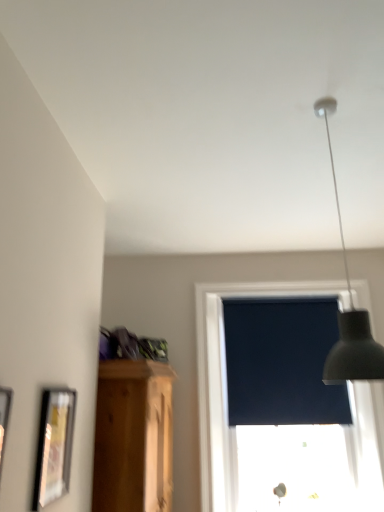
The image size is (384, 512). Describe the element at coordinates (225, 383) in the screenshot. I see `matte black roller blind at upper right` at that location.

Find the location of a particular element. This screenshot has width=384, height=512. wooden picture frame at left, the 2th picture frame in the back-to-front sequence is located at coordinates (4, 419).

Find the location of `dark matte window screen at center`. dark matte window screen at center is located at coordinates (x=282, y=362).

What do you see at coordinates (282, 362) in the screenshot?
I see `dark matte window screen at center` at bounding box center [282, 362].

Identify the location of matte black picture frame at lower left, the 1th picture frame viewed from the back. This screenshot has width=384, height=512. (54, 446).

This screenshot has width=384, height=512. I want to click on matte black roller blind at upper right, so click(225, 383).

Can you confirm if matte black lampshade at upper right is taller than dark matte window screen at center?

Indeed, matte black lampshade at upper right has a greater height compared to dark matte window screen at center.

Which of these two, matte black lampshade at upper right or dark matte window screen at center, is bigger?

With larger size is matte black lampshade at upper right.

Would you say matte black lampshade at upper right is inside or outside dark matte window screen at center?

matte black lampshade at upper right is spatially situated outside dark matte window screen at center.

Is matte black lampshade at upper right next to dark matte window screen at center?

No, matte black lampshade at upper right is not touching dark matte window screen at center.

Measure the distance between matte black picture frame at lower left, the 1th picture frame viewed from the back, and dark matte window screen at center.

matte black picture frame at lower left, the 1th picture frame viewed from the back, and dark matte window screen at center are 7.08 feet apart from each other.

From a real-world perspective, is matte black picture frame at lower left, the 1th picture frame viewed from the back, positioned under dark matte window screen at center based on gravity?

Yes, from a real-world perspective, matte black picture frame at lower left, the 1th picture frame viewed from the back, is beneath dark matte window screen at center.

Is matte black picture frame at lower left, the 2th picture frame from the front, next to dark matte window screen at center?

There is a gap between matte black picture frame at lower left, the 2th picture frame from the front, and dark matte window screen at center.

Considering the relative sizes of matte black picture frame at lower left, the 1th picture frame viewed from the back, and dark matte window screen at center in the image provided, is matte black picture frame at lower left, the 1th picture frame viewed from the back, thinner than dark matte window screen at center?

No.

Which is correct: matte black picture frame at lower left, the 2th picture frame from the front, is inside wooden picture frame at left, the 2th picture frame in the back-to-front sequence, or outside of it?

matte black picture frame at lower left, the 2th picture frame from the front, is not enclosed by wooden picture frame at left, the 2th picture frame in the back-to-front sequence.

From the image's perspective, would you say matte black picture frame at lower left, the 2th picture frame from the front, is positioned over wooden picture frame at left, the 2th picture frame in the back-to-front sequence?

No, from the image's perspective, matte black picture frame at lower left, the 2th picture frame from the front, is not on top of wooden picture frame at left, the 2th picture frame in the back-to-front sequence.

Could you measure the distance between matte black picture frame at lower left, the 1th picture frame viewed from the back, and wooden picture frame at left, the first picture frame when ordered from front to back?

matte black picture frame at lower left, the 1th picture frame viewed from the back, is 41.71 centimeters away from wooden picture frame at left, the first picture frame when ordered from front to back.

Where is `picture frame that appears above the matte black picture frame at lower left, the 1th picture frame viewed from the back (from a real-world perspective)`? Image resolution: width=384 pixels, height=512 pixels. picture frame that appears above the matte black picture frame at lower left, the 1th picture frame viewed from the back (from a real-world perspective) is located at coordinates (4, 419).

Between dark matte window screen at center and matte black picture frame at lower left, the 1th picture frame viewed from the back, which one has more height?

With more height is dark matte window screen at center.

From a real-world perspective, who is located higher, dark matte window screen at center or matte black picture frame at lower left, the 2th picture frame from the front?

dark matte window screen at center is physically above.

Is dark matte window screen at center far away from matte black picture frame at lower left, the 2th picture frame from the front?

dark matte window screen at center is positioned a significant distance from matte black picture frame at lower left, the 2th picture frame from the front.

Would you say dark matte window screen at center contains matte black picture frame at lower left, the 1th picture frame viewed from the back?

No.

What's the angular difference between matte black lampshade at upper right and matte black roller blind at upper right's facing directions?

matte black lampshade at upper right and matte black roller blind at upper right are facing 60.5 degrees away from each other.

Considering the sizes of matte black lampshade at upper right and matte black roller blind at upper right in the image, is matte black lampshade at upper right bigger or smaller than matte black roller blind at upper right?

In the image, matte black lampshade at upper right appears to be smaller than matte black roller blind at upper right.

From the image's perspective, would you say matte black lampshade at upper right is positioned over matte black roller blind at upper right?

Yes.

This screenshot has width=384, height=512. Find the location of `window below the matte black lampshade at upper right (from the image's perspective)`. window below the matte black lampshade at upper right (from the image's perspective) is located at coordinates (225, 383).

Could you tell me if matte black lampshade at upper right is turned towards wooden picture frame at left, the first picture frame when ordered from front to back?

No, matte black lampshade at upper right is not turned towards wooden picture frame at left, the first picture frame when ordered from front to back.

In the scene shown: Between matte black lampshade at upper right and wooden picture frame at left, the 2th picture frame in the back-to-front sequence, which one has smaller width?

Thinner between the two is wooden picture frame at left, the 2th picture frame in the back-to-front sequence.

Considering the relative sizes of matte black lampshade at upper right and wooden picture frame at left, the first picture frame when ordered from front to back, in the image provided, is matte black lampshade at upper right smaller than wooden picture frame at left, the first picture frame when ordered from front to back,?

No.

Can you confirm if matte black lampshade at upper right is taller than wooden picture frame at left, the first picture frame when ordered from front to back?

Yes, matte black lampshade at upper right is taller than wooden picture frame at left, the first picture frame when ordered from front to back.

The width and height of the screenshot is (384, 512). In order to click on window to the right of wooden picture frame at left, the 2th picture frame in the back-to-front sequence in this screenshot , I will do `click(225, 383)`.

Is wooden picture frame at left, the first picture frame when ordered from front to back, facing towards matte black roller blind at upper right?

No, wooden picture frame at left, the first picture frame when ordered from front to back, is not facing towards matte black roller blind at upper right.

Is matte black roller blind at upper right a part of wooden picture frame at left, the 2th picture frame in the back-to-front sequence?

No, wooden picture frame at left, the 2th picture frame in the back-to-front sequence, does not contain matte black roller blind at upper right.

From the image's perspective, is wooden picture frame at left, the 2th picture frame in the back-to-front sequence, above or below matte black roller blind at upper right?

From the image's perspective, wooden picture frame at left, the 2th picture frame in the back-to-front sequence, appears above matte black roller blind at upper right.

Identify the location of lamp above the dark matte window screen at center (from the image's perspective). (349, 312).

Which picture frame is the 1st one when counting from the left side of the dark matte window screen at center? Please provide its 2D coordinates.

[(54, 446)]

Which object lies further to the anchor point matte black picture frame at lower left, the 1th picture frame viewed from the back, matte black lampshade at upper right or dark matte window screen at center?

dark matte window screen at center is positioned further to the anchor matte black picture frame at lower left, the 1th picture frame viewed from the back.

Which object lies further to the anchor point matte black lampshade at upper right, matte black roller blind at upper right or matte black picture frame at lower left, the 2th picture frame from the front?

matte black roller blind at upper right is positioned further to the anchor matte black lampshade at upper right.

Which object lies further to the anchor point matte black lampshade at upper right, dark matte window screen at center or wooden picture frame at left, the first picture frame when ordered from front to back?

Based on the image, dark matte window screen at center appears to be further to matte black lampshade at upper right.

From the image, which object appears to be nearer to matte black picture frame at lower left, the 2th picture frame from the front, matte black roller blind at upper right or dark matte window screen at center?

matte black roller blind at upper right is positioned closer to the anchor matte black picture frame at lower left, the 2th picture frame from the front.

From the image, which object appears to be nearer to wooden picture frame at left, the 2th picture frame in the back-to-front sequence, matte black roller blind at upper right or matte black lampshade at upper right?

Based on the image, matte black lampshade at upper right appears to be nearer to wooden picture frame at left, the 2th picture frame in the back-to-front sequence.

Considering their positions, is matte black picture frame at lower left, the 2th picture frame from the front, positioned further to matte black roller blind at upper right than matte black lampshade at upper right?

Among the two, matte black lampshade at upper right is located further to matte black roller blind at upper right.

Which object lies further to the anchor point matte black lampshade at upper right, wooden picture frame at left, the 2th picture frame in the back-to-front sequence, or matte black picture frame at lower left, the 2th picture frame from the front?

Among the two, matte black picture frame at lower left, the 2th picture frame from the front, is located further to matte black lampshade at upper right.

Based on their spatial positions, is matte black lampshade at upper right or wooden picture frame at left, the first picture frame when ordered from front to back, closer to dark matte window screen at center?

Based on the image, matte black lampshade at upper right appears to be nearer to dark matte window screen at center.

Find the location of a particular element. Image resolution: width=384 pixels, height=512 pixels. picture frame located between matte black lampshade at upper right and matte black roller blind at upper right in the depth direction is located at coordinates (54, 446).

In order to click on lamp located between wooden picture frame at left, the first picture frame when ordered from front to back, and dark matte window screen at center in the depth direction in this screenshot , I will do `click(349, 312)`.

Locate an element on the screen. window located between matte black picture frame at lower left, the 1th picture frame viewed from the back, and dark matte window screen at center in the depth direction is located at coordinates coord(225,383).

In order to click on picture frame between wooden picture frame at left, the first picture frame when ordered from front to back, and dark matte window screen at center from front to back in this screenshot , I will do `click(54, 446)`.